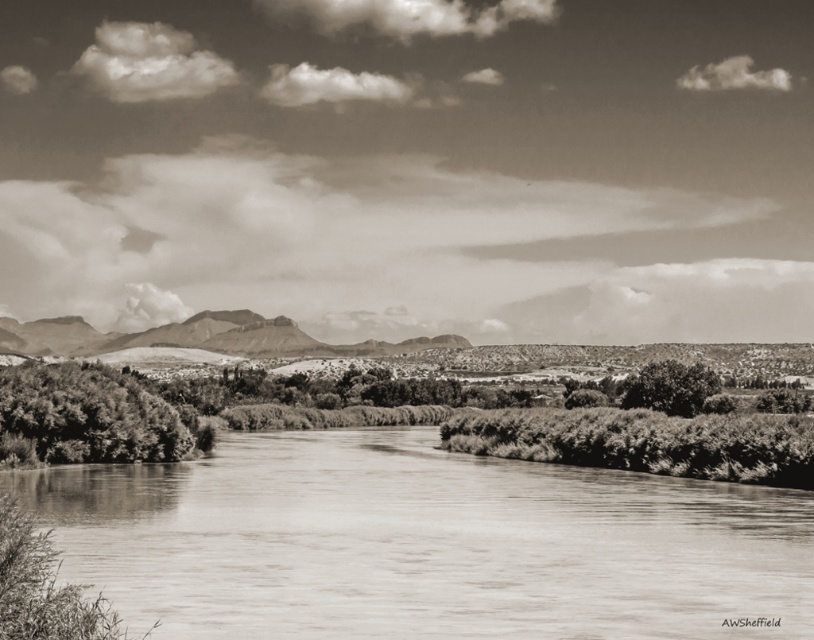
You are standing at the point marked by coordinates point (x=82, y=417) in the image. Looking around, you see thick foliage at left. Which direction should you walk to reach the river flowing through the semi arid region?

Since you are at point (x=82, y=417) which corresponds to thick foliage at left, you should walk towards the right to reach the river flowing through the semi arid region.

You are an explorer standing at the edge of the river. You see the smooth water at center and the rugged stone mountain at center. Which object is nearer to you?

The smooth water at center is closer to the viewer than the rugged stone mountain at center.

You are standing at the edge of the river and want to walk towards the grainy textured bush at right. Which direction should you move relative to the smooth water at center?

Since the smooth water at center is closer to the viewer than the grainy textured bush at right, you should move towards the right direction away from the smooth water at center to reach the grainy textured bush at right.